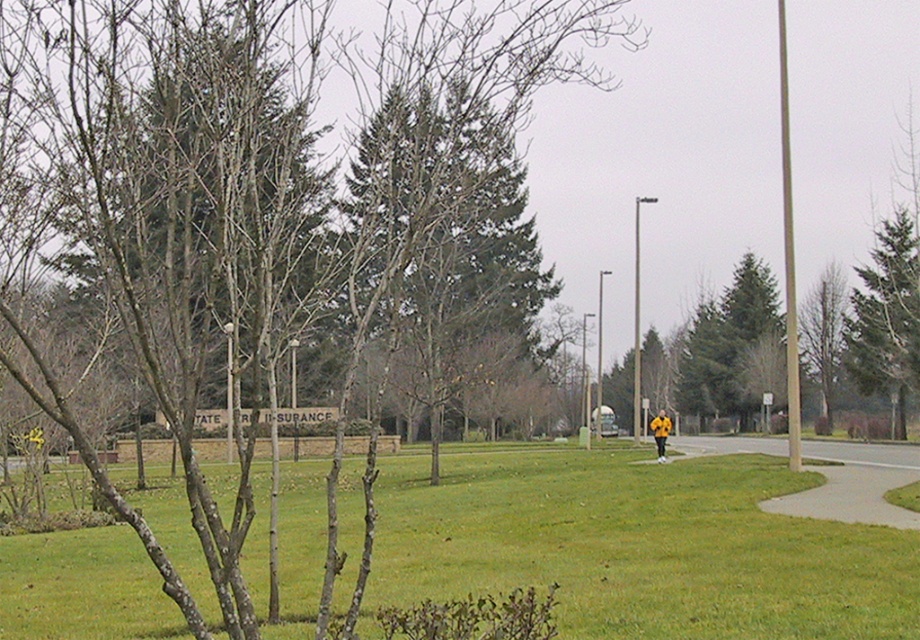
Question: Can you confirm if green textured tree at upper right is bigger than concrete sidewalk at lower right?

Choices:
 (A) no
 (B) yes

Answer: (B)

Question: Which is farther from the green textured tree at upper right?

Choices:
 (A) yellow matte jacket at center
 (B) smooth bark tree at center
 (C) green grass at center
 (D) concrete sidewalk at lower right

Answer: (C)

Question: Which point is closer to the camera?

Choices:
 (A) (420, 109)
 (B) (903, 456)
 (C) (869, 376)
 (D) (318, 518)

Answer: (A)

Question: Is the position of green grass at center less distant than that of green textured tree at upper right?

Choices:
 (A) yes
 (B) no

Answer: (A)

Question: Based on their relative distances, which object is nearer to the green textured tree at upper right?

Choices:
 (A) smooth bark tree at center
 (B) concrete sidewalk at lower right
 (C) yellow matte jacket at center
 (D) green grass at center

Answer: (B)

Question: Does smooth bark tree at center have a lesser width compared to concrete sidewalk at lower right?

Choices:
 (A) no
 (B) yes

Answer: (A)